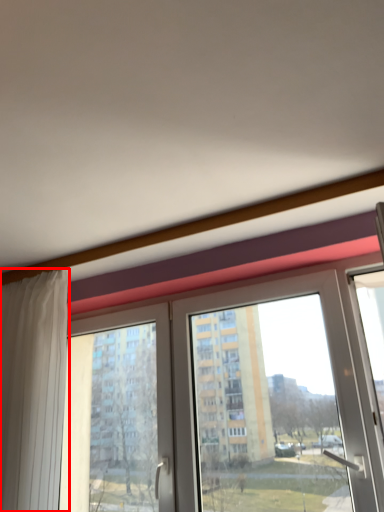
Question: From the image's perspective, what is the correct spatial relationship of curtain (annotated by the red box) in relation to window?

Choices:
 (A) above
 (B) below

Answer: (B)